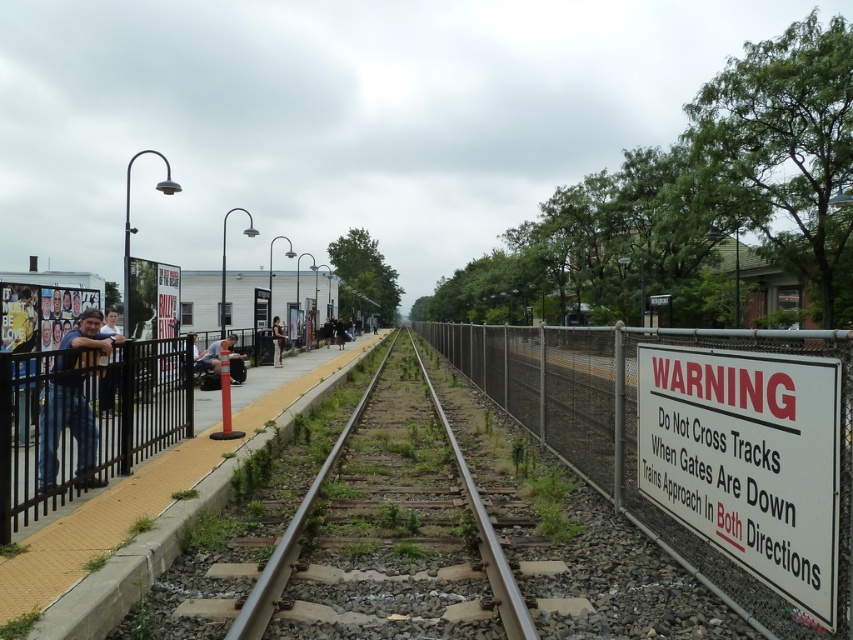
Can you confirm if white paper sign at right is bigger than black metal fence at left?

Actually, white paper sign at right might be smaller than black metal fence at left.

Is white paper sign at right to the left of black metal fence at left from the viewer's perspective?

No, white paper sign at right is not to the left of black metal fence at left.

Find the location of a particular element. The height and width of the screenshot is (640, 853). white paper sign at right is located at coordinates (747, 461).

Where is `white paper sign at right`? This screenshot has height=640, width=853. white paper sign at right is located at coordinates (747, 461).

Who is taller, metallic rail at center or matte black backpack at center?

Standing taller between the two is metallic rail at center.

Measure the distance between metallic rail at center and camera.

A distance of 3.63 meters exists between metallic rail at center and camera.

I want to click on metallic rail at center, so [x=698, y=444].

From the picture: Can you confirm if smooth metal train track at center is wider than light brown leather jacket at center?

Correct, the width of smooth metal train track at center exceeds that of light brown leather jacket at center.

Who is higher up, smooth metal train track at center or light brown leather jacket at center?

Positioned higher is light brown leather jacket at center.

Is point (241, 636) farther from viewer compared to point (279, 349)?

No, it is not.

The width and height of the screenshot is (853, 640). I want to click on smooth metal train track at center, so click(x=292, y=536).